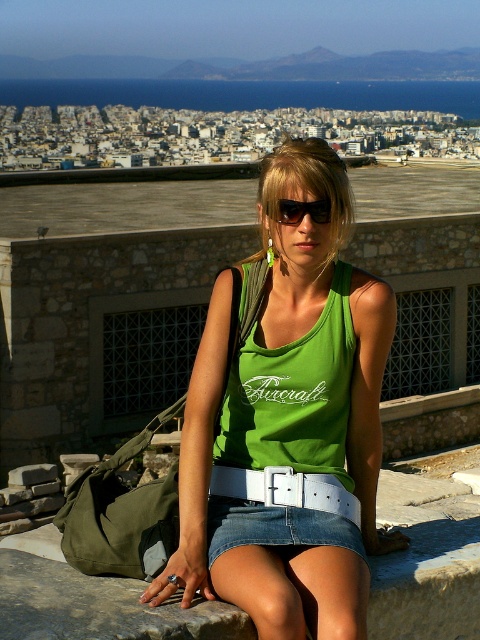
Question: Among these objects, which one is farthest from the camera?

Choices:
 (A) green fabric vest at center
 (B) white leather belt at center
 (C) green fabric tank top at center

Answer: (A)

Question: Is green fabric vest at center further to the viewer compared to black plastic sunglasses at center?

Choices:
 (A) yes
 (B) no

Answer: (B)

Question: Estimate the real-world distances between objects in this image. Which object is farther from the black plastic sunglasses at center?

Choices:
 (A) green fabric tank top at center
 (B) white leather belt at center
 (C) green fabric vest at center

Answer: (B)

Question: Which object appears farthest from the camera in this image?

Choices:
 (A) green fabric tank top at center
 (B) black plastic sunglasses at center
 (C) white leather belt at center
 (D) green fabric vest at center

Answer: (B)

Question: Does green fabric tank top at center have a greater width compared to black plastic sunglasses at center?

Choices:
 (A) yes
 (B) no

Answer: (A)

Question: Does green fabric vest at center appear on the right side of white leather belt at center?

Choices:
 (A) yes
 (B) no

Answer: (A)